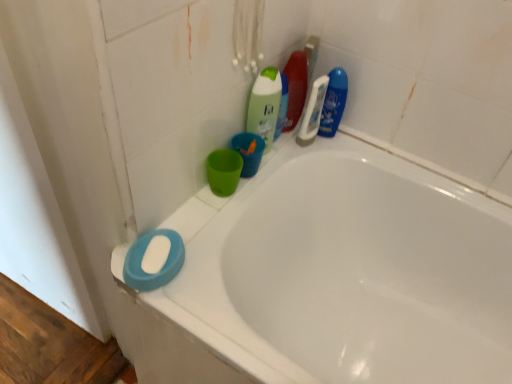
Identify the location of vacant region in front of green matte bottle at upper center, the first cleaning product positioned from the left. (231, 196).